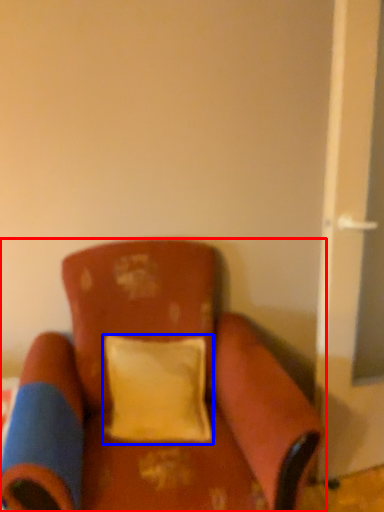
Question: Which object is closer to the camera taking this photo, chair (highlighted by a red box) or pillow (highlighted by a blue box)?

Choices:
 (A) chair
 (B) pillow

Answer: (A)